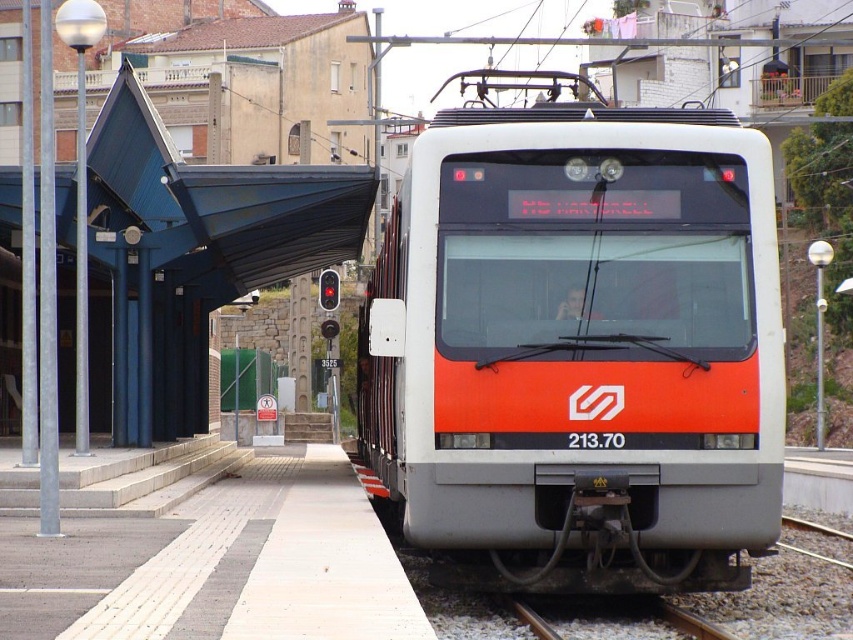
Does orange glossy train at center have a larger size compared to brown gravel train track at lower center?

Yes.

Between orange glossy train at center and brown gravel train track at lower center, which one has more height?

With more height is orange glossy train at center.

Is point (639, 208) positioned in front of point (537, 625)?

No, it is not.

Locate an element on the screen. Image resolution: width=853 pixels, height=640 pixels. orange glossy train at center is located at coordinates (577, 346).